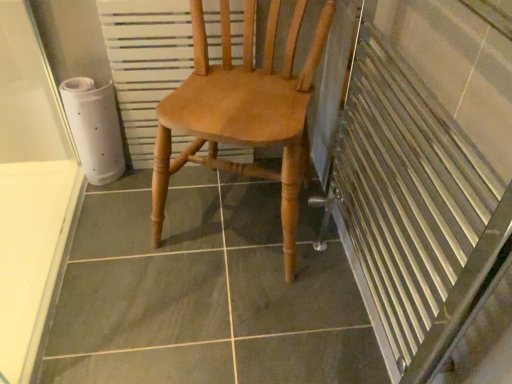
What are the coordinates of `vacant space to the left of light brown wood chair at center` in the screenshot? It's located at (83, 238).